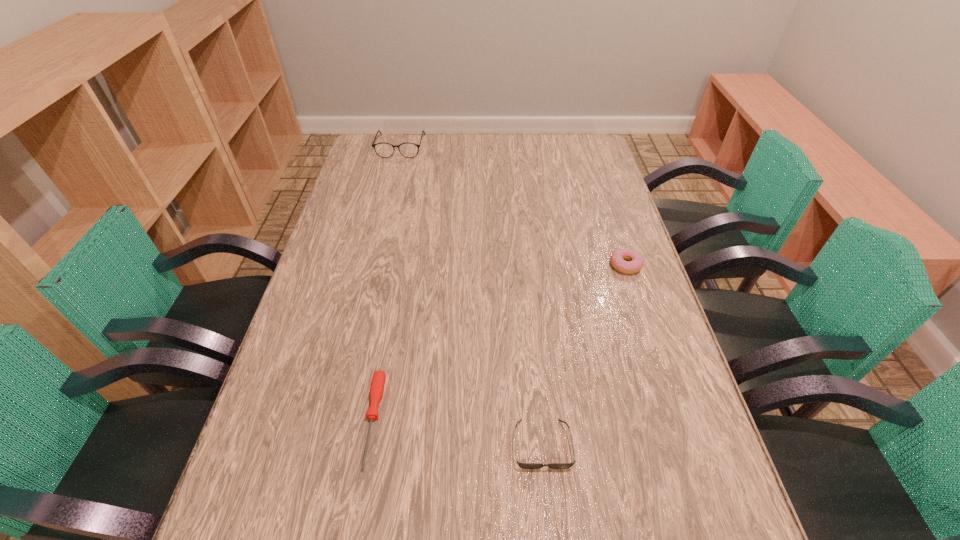
This screenshot has height=540, width=960. What are the coordinates of `object that is at the left edge` in the screenshot? It's located at (385, 150).

Locate an element on the screen. The image size is (960, 540). object at the right edge is located at coordinates point(635,262).

Locate an element on the screen. object situated at the far left corner is located at coordinates (385, 150).

Locate an element on the screen. vacant position at the far edge of the desktop is located at coordinates (559, 167).

The image size is (960, 540). In order to click on vacant space at the left edge of the desktop in this screenshot , I will do `click(383, 198)`.

What are the coordinates of `blank space at the right edge of the desktop` in the screenshot? It's located at (610, 329).

In the image, there is a desktop. In order to click on vacant space at the far left corner in this screenshot , I will do `click(376, 165)`.

Locate an element on the screen. vacant area between the screwdriver and the spectacles is located at coordinates (387, 283).

This screenshot has height=540, width=960. In order to click on vacant region between the shortest object and the farthest object in this screenshot , I will do `click(387, 283)`.

Identify the location of free space between the sunglasses and the spectacles. This screenshot has height=540, width=960. (471, 295).